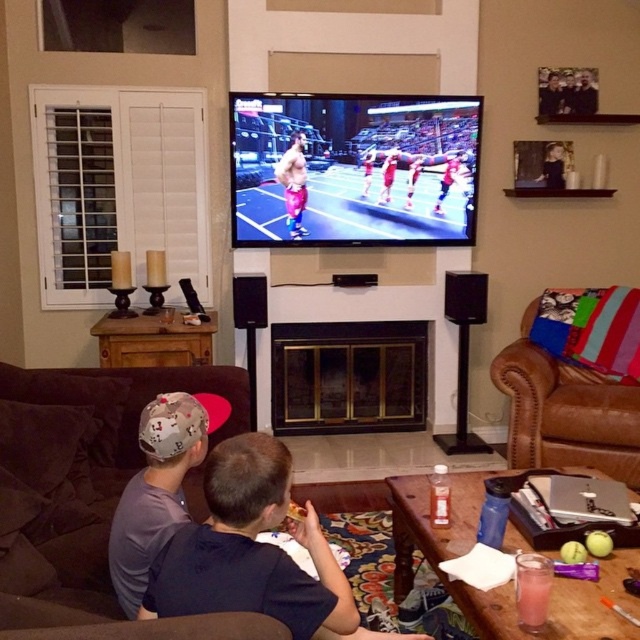
Does point (97, 572) come behind point (611, 449)?

No, it is not.

Between brown fabric couch at lower left and brown leather couch at right, which one is positioned lower?

brown fabric couch at lower left is lower down.

Does point (109, 461) come in front of point (561, 410)?

Yes, point (109, 461) is closer to viewer.

The width and height of the screenshot is (640, 640). I want to click on brown fabric couch at lower left, so click(77, 481).

Which is below, brown leather couch at right or pink fabric shorts at center?

Positioned lower is brown leather couch at right.

Does brown leather couch at right have a lesser width compared to pink fabric shorts at center?

Incorrect, brown leather couch at right's width is not less than pink fabric shorts at center's.

Which is behind, point (515, 404) or point (292, 228)?

Positioned behind is point (292, 228).

Find the location of a particular element. brown leather couch at right is located at coordinates (564, 412).

Who is lower down, brown fabric couch at lower left or gray fabric cap at left?

Positioned lower is brown fabric couch at lower left.

Can you confirm if brown fabric couch at lower left is thinner than gray fabric cap at left?

No, brown fabric couch at lower left is not thinner than gray fabric cap at left.

Identify the location of brown fabric couch at lower left. coord(77,481).